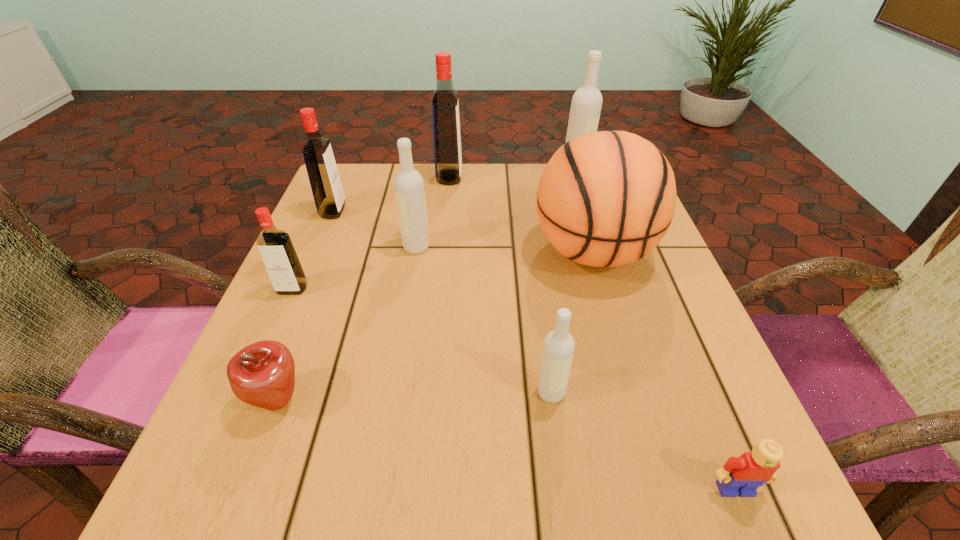
At what (x,y) coordinates should I click in order to perform the action: click on object present at the near right corner. Please return your answer as a coordinate pair (x, y). The image size is (960, 540). Looking at the image, I should click on (742, 475).

You are a GUI agent. You are given a task and a screenshot of the screen. Output one action in this format:
    pyautogui.click(x=<x>, y=<y>)
    Task: Click on the free space at the far edge of the desktop
    
    Given the screenshot: What is the action you would take?
    point(488,172)

This screenshot has width=960, height=540. In order to click on vacant area at the near edge of the desktop in this screenshot , I will do `click(465, 504)`.

In the image, there is a desktop. In order to click on blank space at the left edge in this screenshot , I will do `click(324, 226)`.

In the image, there is a desktop. Identify the location of vacant area at the right edge. (701, 378).

You are a GUI agent. You are given a task and a screenshot of the screen. Output one action in this format:
    pyautogui.click(x=<x>, y=<y>)
    Task: Click on the vacant point at the far left corner
    This screenshot has width=960, height=540.
    Given the screenshot: What is the action you would take?
    pyautogui.click(x=368, y=183)

Image resolution: width=960 pixels, height=540 pixels. In the image, there is a desktop. Identify the location of vacant space at the near right corner. (715, 470).

This screenshot has width=960, height=540. I want to click on free space between the nearest white vodka and the nearest object, so point(643,441).

Identify the location of vacant space that's between the apple and the second biggest red vodka. (305, 306).

Locate an element on the screen. This screenshot has height=540, width=960. vacant area between the apple and the farthest red vodka is located at coordinates (364, 288).